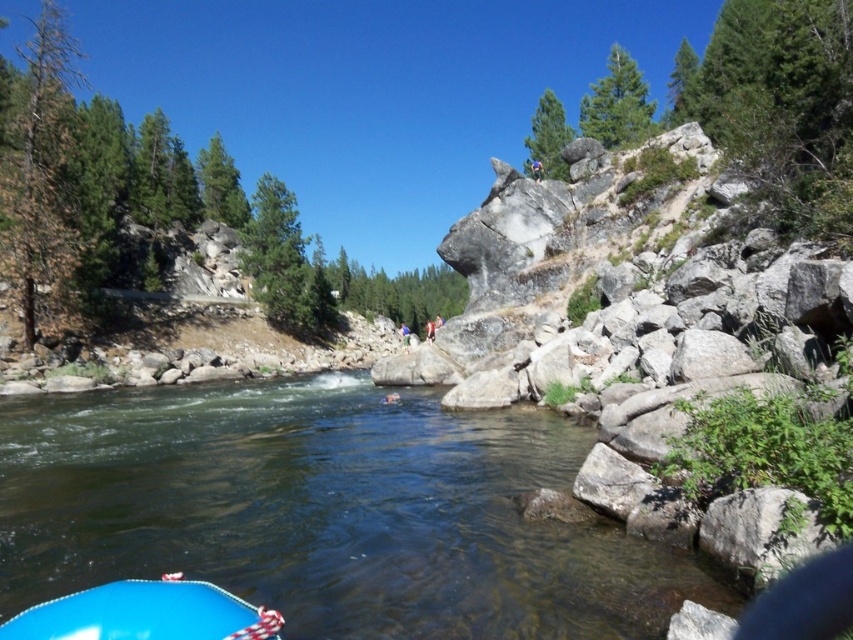
You are standing at the edge of the river and see the clear water at lower center and the blue fabric person at center. Which object is nearer to you?

The clear water at lower center is closer to the viewer than the blue fabric person at center.

You are a kayaker planning to navigate the river shown in the image. You see the clear water at lower center and the blue rubber boat at lower left. Which object is wider from your perspective?

The clear water at lower center might be wider than blue rubber boat at lower left according to the description.